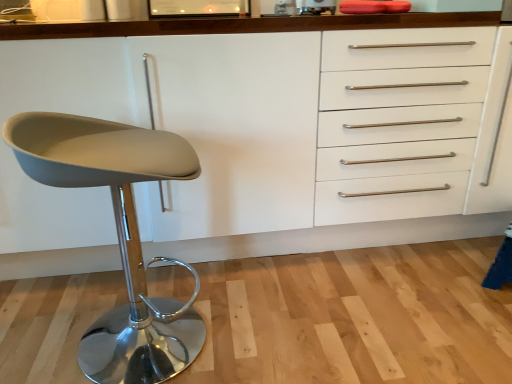
Question: From the image's perspective, is matte gray seat at left below white wood cabinet at center?

Choices:
 (A) yes
 (B) no

Answer: (A)

Question: Considering the relative sizes of matte gray seat at left and white wood cabinet at center in the image provided, is matte gray seat at left smaller than white wood cabinet at center?

Choices:
 (A) no
 (B) yes

Answer: (B)

Question: Is matte gray seat at left not within white wood cabinet at center?

Choices:
 (A) yes
 (B) no

Answer: (A)

Question: From a real-world perspective, is matte gray seat at left under white wood cabinet at center?

Choices:
 (A) no
 (B) yes

Answer: (B)

Question: Are matte gray seat at left and white wood cabinet at center beside each other?

Choices:
 (A) yes
 (B) no

Answer: (B)

Question: Is matte gray seat at left closer to the viewer compared to white wood cabinet at center?

Choices:
 (A) yes
 (B) no

Answer: (A)

Question: Can you confirm if white wood cabinet at center is wider than matte gray seat at left?

Choices:
 (A) yes
 (B) no

Answer: (A)

Question: Is white wood cabinet at center positioned in front of matte gray seat at left?

Choices:
 (A) yes
 (B) no

Answer: (B)

Question: Can you confirm if white wood cabinet at center is positioned to the right of matte gray seat at left?

Choices:
 (A) yes
 (B) no

Answer: (A)

Question: Can we say white wood cabinet at center lies outside matte gray seat at left?

Choices:
 (A) no
 (B) yes

Answer: (B)

Question: From the image's perspective, is white wood cabinet at center under matte gray seat at left?

Choices:
 (A) yes
 (B) no

Answer: (B)

Question: Is white wood cabinet at center far away from matte gray seat at left?

Choices:
 (A) yes
 (B) no

Answer: (B)

Question: Visually, is matte gray seat at left positioned to the left or to the right of white wood cabinet at center?

Choices:
 (A) left
 (B) right

Answer: (A)